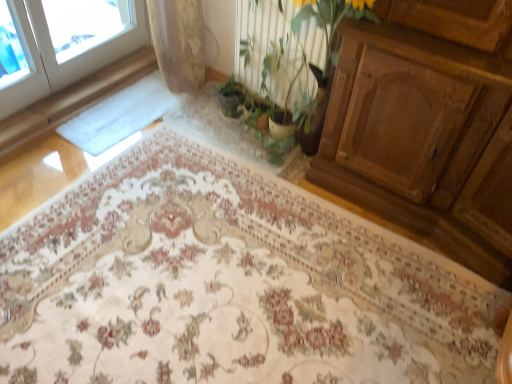
Question: Can you confirm if floral carpet at center is positioned to the left of green leafy plant at center?

Choices:
 (A) yes
 (B) no

Answer: (A)

Question: Is green leafy plant at center inside floral carpet at center?

Choices:
 (A) no
 (B) yes

Answer: (A)

Question: Is floral carpet at center far from green leafy plant at center?

Choices:
 (A) no
 (B) yes

Answer: (A)

Question: Can you confirm if floral carpet at center is wider than green leafy plant at center?

Choices:
 (A) no
 (B) yes

Answer: (B)

Question: Is floral carpet at center thinner than green leafy plant at center?

Choices:
 (A) yes
 (B) no

Answer: (B)

Question: Considering the positions of green leafy plant at center and floral carpet at center in the image, is green leafy plant at center wider or thinner than floral carpet at center?

Choices:
 (A) wide
 (B) thin

Answer: (B)

Question: Is green leafy plant at center inside or outside of floral carpet at center?

Choices:
 (A) inside
 (B) outside

Answer: (B)

Question: Would you say green leafy plant at center is to the left or to the right of floral carpet at center in the picture?

Choices:
 (A) left
 (B) right

Answer: (B)

Question: From the image's perspective, is green leafy plant at center above or below floral carpet at center?

Choices:
 (A) above
 (B) below

Answer: (A)

Question: From their relative heights in the image, would you say floral carpet at center is taller or shorter than green matte plant at center?

Choices:
 (A) short
 (B) tall

Answer: (A)

Question: Would you say floral carpet at center is to the left or to the right of green matte plant at center in the picture?

Choices:
 (A) right
 (B) left

Answer: (B)

Question: Considering their positions, is floral carpet at center located in front of or behind green matte plant at center?

Choices:
 (A) behind
 (B) front

Answer: (B)

Question: Is floral carpet at center inside the boundaries of green matte plant at center, or outside?

Choices:
 (A) inside
 (B) outside

Answer: (B)

Question: Relative to green matte plant at center, is green leafy plant at center in front or behind?

Choices:
 (A) front
 (B) behind

Answer: (A)

Question: From a real-world perspective, is green leafy plant at center positioned above or below green matte plant at center?

Choices:
 (A) below
 (B) above

Answer: (B)